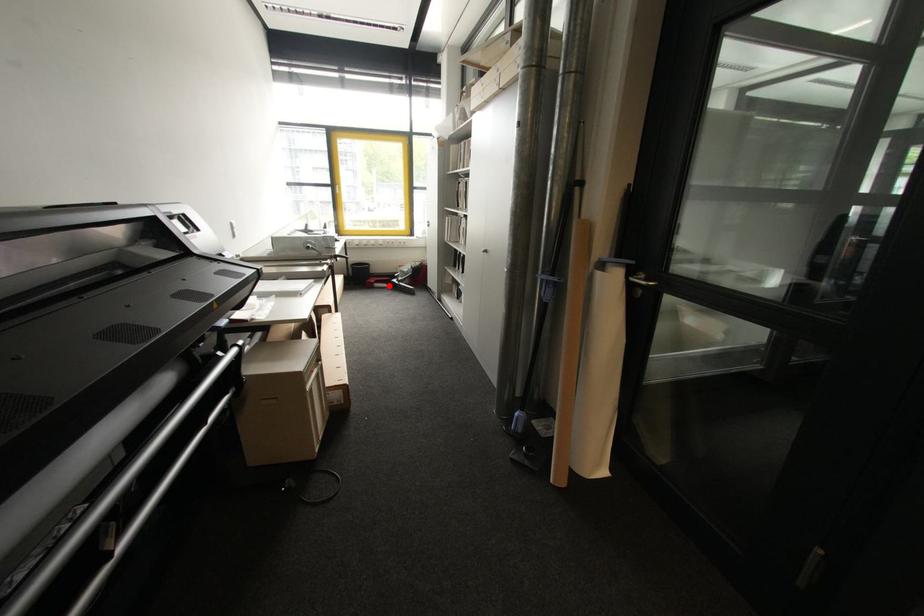
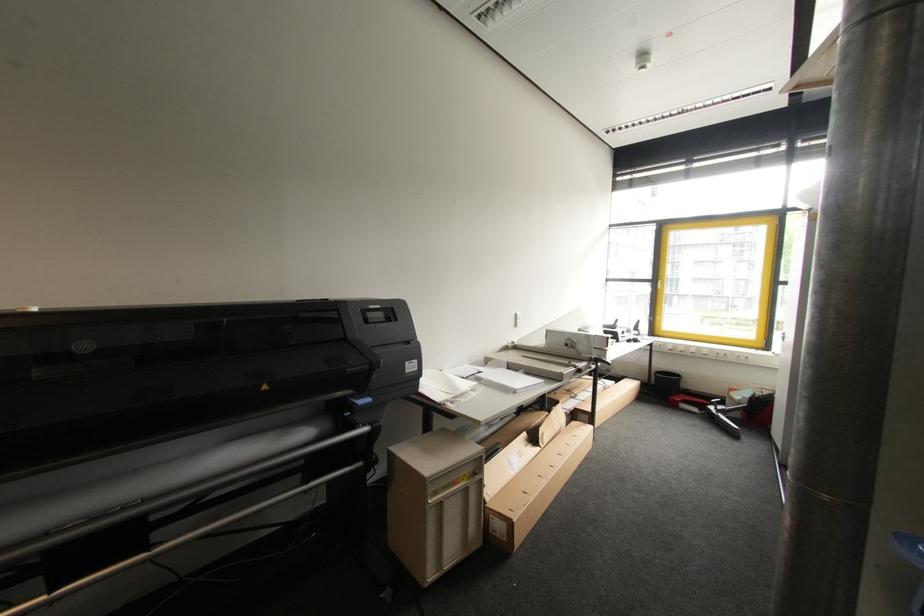
Question: I am providing you with two images of the same scene from different viewpoints. Given a red point in image1, look at the same physical point in image2. Is it:

Choices:
 (A) Closer to the viewpoint
 (B) Farther from the viewpoint

Answer: (B)